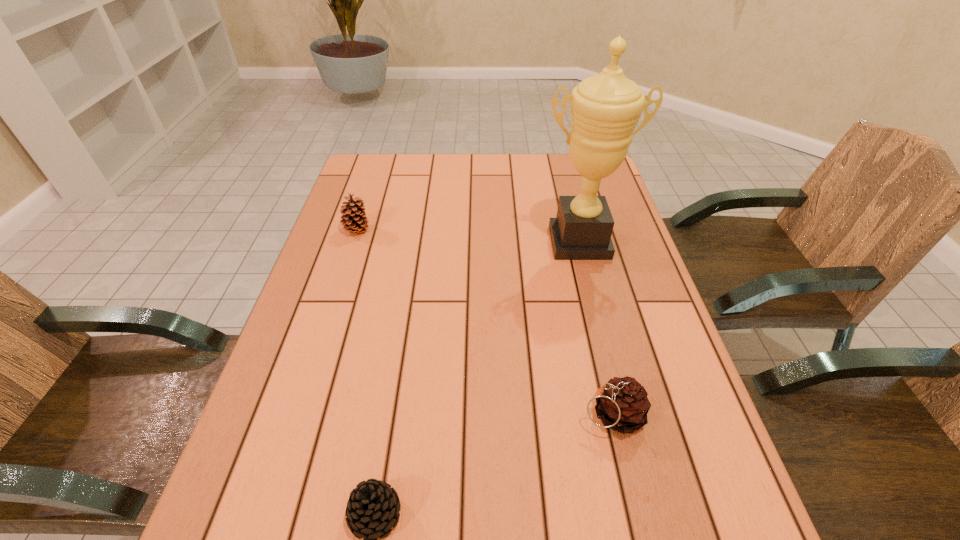
Where is `vacant point located between the trophy cup and the third farthest object`? The height and width of the screenshot is (540, 960). vacant point located between the trophy cup and the third farthest object is located at coordinates (595, 328).

I want to click on vacant space that is in between the tallest object and the third farthest object, so pyautogui.click(x=595, y=328).

I want to click on unoccupied position between the trophy cup and the second nearest pinecone, so click(x=595, y=328).

Locate an element on the screen. unoccupied area between the second farthest pinecone and the trophy cup is located at coordinates (595, 328).

This screenshot has height=540, width=960. I want to click on the second closest object to the tallest object, so click(x=355, y=221).

Locate an element on the screen. The width and height of the screenshot is (960, 540). object that stands as the second closest to the second object from left to right is located at coordinates (605, 108).

Locate which pinecone ranks in proximity to the leftmost object. Please provide its 2D coordinates. Your answer should be formatted as a tuple, i.e. [(x, y)], where the tuple contains the x and y coordinates of a point satisfying the conditions above.

[(373, 507)]

Identify which pinecone is the second closest to the trophy cup. Please provide its 2D coordinates. Your answer should be formatted as a tuple, i.e. [(x, y)], where the tuple contains the x and y coordinates of a point satisfying the conditions above.

[(355, 221)]

At what (x,y) coordinates should I click in order to perform the action: click on free region that satisfies the following two spatial constraints: 1. at the front of the trophy cup with handles; 2. with a leaf charm attached to the second farthest pinecone. Please return your answer as a coordinate pair (x, y). This screenshot has width=960, height=540. Looking at the image, I should click on (623, 414).